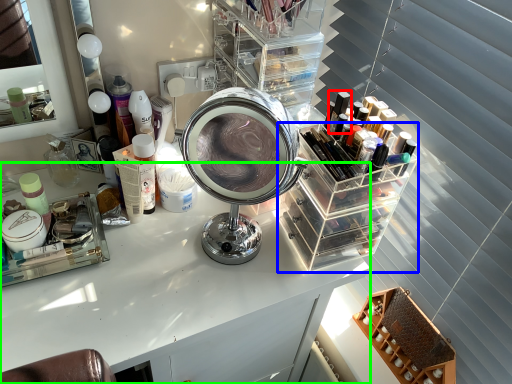
Question: Considering the real-world distances, which object is farthest from toiletry (highlighted by a red box)? glass box (highlighted by a blue box) or table (highlighted by a green box)?

Choices:
 (A) glass box
 (B) table

Answer: (B)